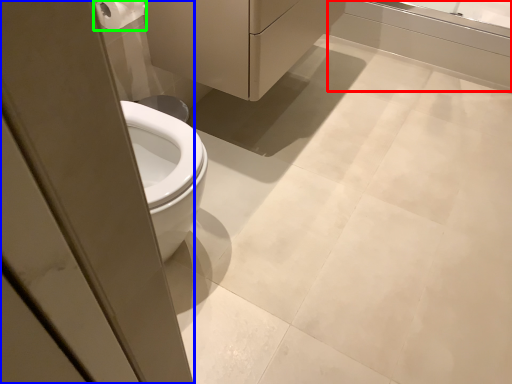
Question: Which object is positioned farthest from bath (highlighted by a red box)? Select from screen door (highlighted by a blue box) and toilet paper (highlighted by a green box).

Choices:
 (A) screen door
 (B) toilet paper

Answer: (A)